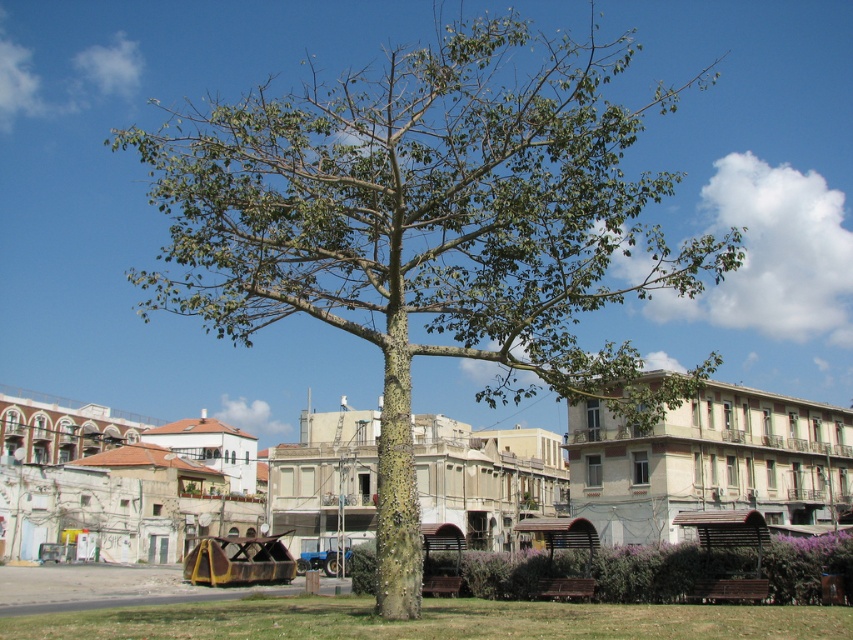
You are standing in the residential area looking at the tree and the buildings. There are two points marked in the image. The first point is at coordinates point (550, 321) and the second is at point (540, 438). Which point is closer to you?

Point (550, 321) is closer to the camera than point (540, 438).

You are standing in the residential area shown in the image. There is a green rough bark tree at center marked by point (428, 228). If you face the tree, which direction should you turn to see the buildings in the background?

The green rough bark tree at center is represented by point (428, 228). The buildings are in the background behind the tree, so if you face the tree, you should turn towards the buildings behind it. However, the exact direction depends on the layout of the buildings relative to the tree, which isn

You are standing in the residential area and see the green rough bark tree at center and the green rough tree at center. Which one is more to the right?

The green rough bark tree at center is more to the right because it is positioned on the right side of the green rough tree at center.